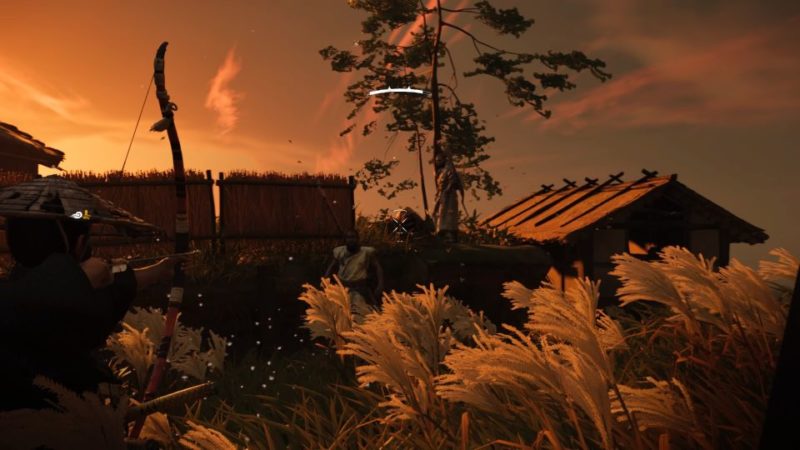
You are a GUI agent. You are given a task and a screenshot of the screen. Output one action in this format:
    pyautogui.click(x=<x>, y=<y>)
    Task: Click on the black lines on roof
    
    Given the screenshot: What is the action you would take?
    pyautogui.click(x=557, y=210), pyautogui.click(x=510, y=204), pyautogui.click(x=520, y=209), pyautogui.click(x=526, y=214), pyautogui.click(x=574, y=215)